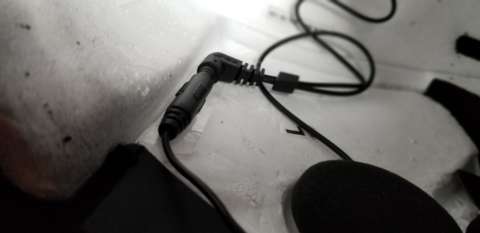
Locate an element on the screen. black cord is located at coordinates (227, 72), (304, 125).